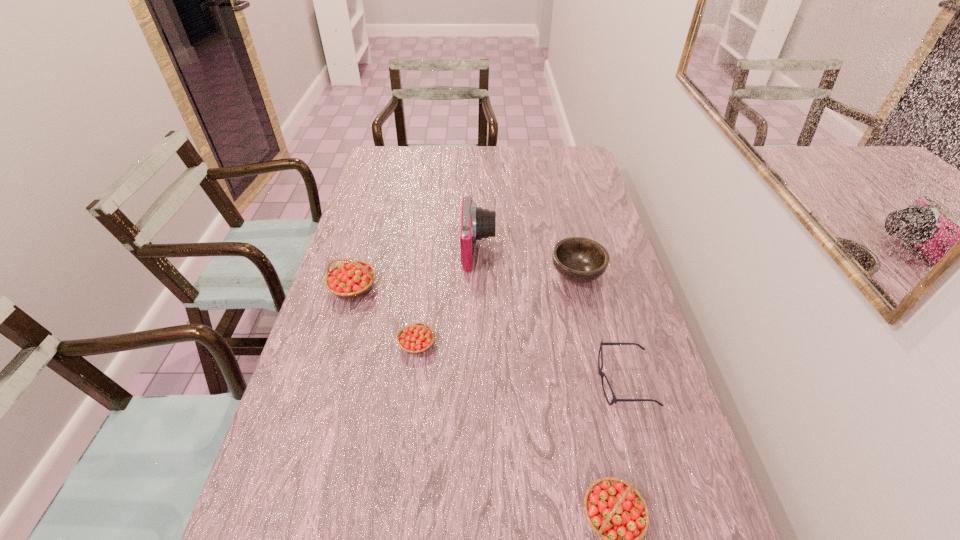
If equal spacing is desired by inserting an extra strawberry among them, please point out a free spot for this new strawberry. Please provide its 2D coordinates. Your answer should be formatted as a tuple, i.e. [(x, y)], where the tuple contains the x and y coordinates of a point satisfying the conditions above.

[(500, 417)]